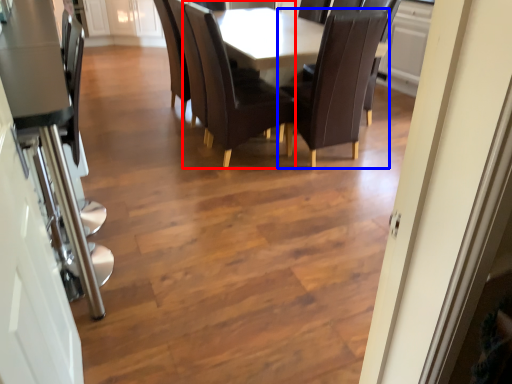
Question: Which of the following is the farthest to the observer, chair (highlighted by a red box) or chair (highlighted by a blue box)?

Choices:
 (A) chair
 (B) chair

Answer: (A)